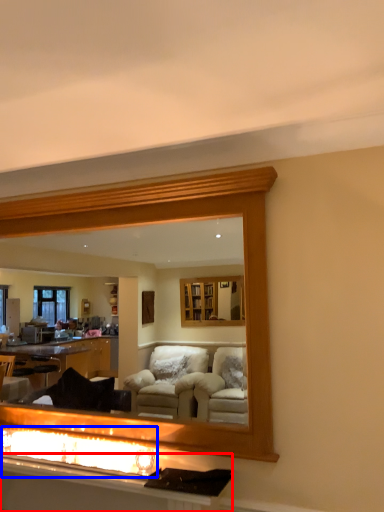
Question: Which object is further to the camera taking this photo, vanity (highlighted by a red box) or reflection (highlighted by a blue box)?

Choices:
 (A) vanity
 (B) reflection

Answer: (B)